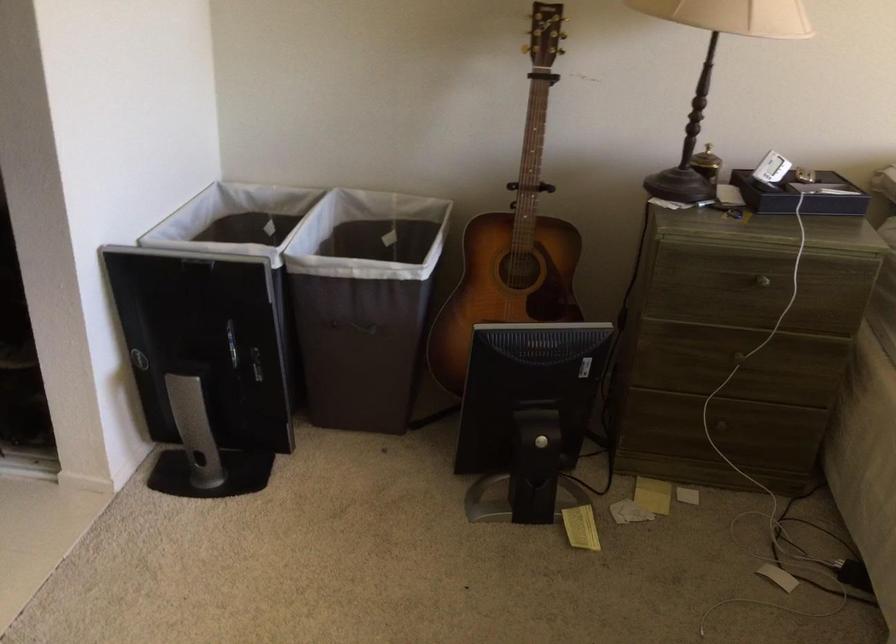
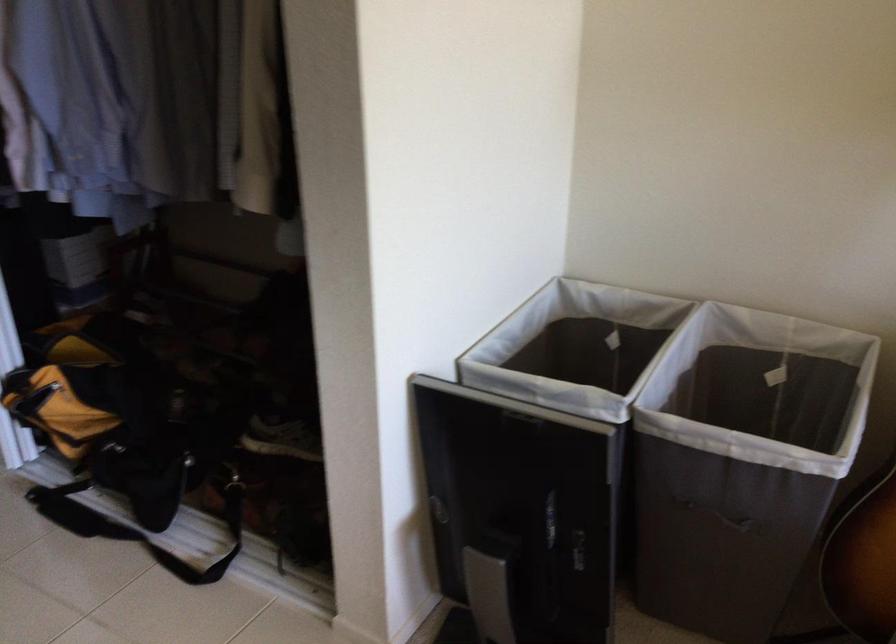
Locate, in the second image, the point that corresponds to the point at 364,283 in the first image.

(742, 462)